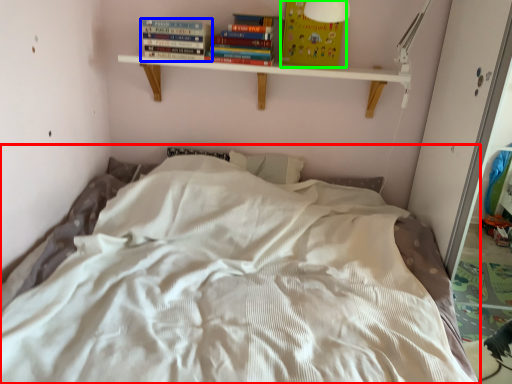
Question: Based on their relative distances, which object is nearer to bed (highlighted by a red box)? Choose from book (highlighted by a blue box) and paperback book (highlighted by a green box).

Choices:
 (A) book
 (B) paperback book

Answer: (A)